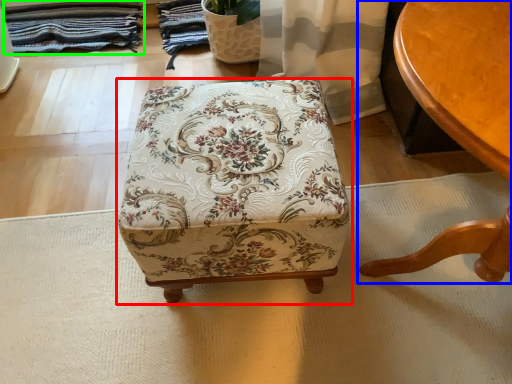
Question: Which object is the closest to the furniture (highlighted by a red box)? Choose among these: table (highlighted by a blue box) or blanket (highlighted by a green box).

Choices:
 (A) table
 (B) blanket

Answer: (A)